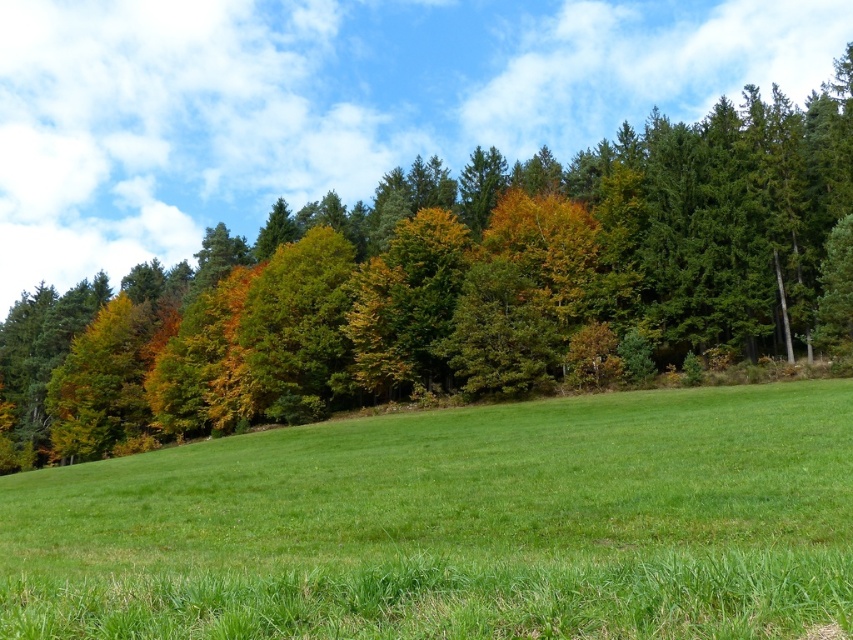
You are standing in the meadow and want to walk towards the green leafy trees at upper center. Which direction should you move relative to the green grass at center?

You should move to the left relative to the green grass at center because the green grass at center is positioned on the right side of the green leafy trees at upper center, meaning the trees are to the left of the grass from your perspective.

You are standing at the center of the meadow and want to walk towards the forest. Which direction should you walk to avoid the green grass at center?

You should walk towards the forest in a direction that avoids the green grass at center. Since the green grass at center is located at point coordinates, you can walk either to the left or right of it to reach the forest without stepping on the grass.